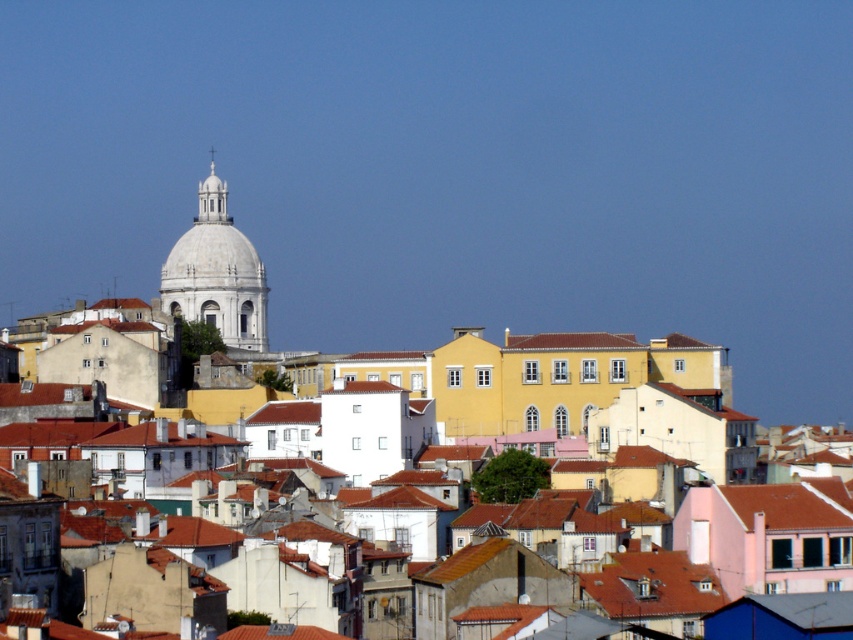
You are an architect analyzing the urban layout of this historic city. You notice the yellow matte building at center and the white marble dome at upper center. Based on their positions and sizes, which structure would cast a longer shadow during midday? Please explain your reasoning.

The white marble dome at upper center is taller than the yellow matte building at center. Since taller structures cast longer shadows, the white marble dome at upper center would cast a longer shadow during midday.

You are standing in the city square and want to take a photo of the point at coordinates point [135,483]. If your camera can focus up to 500 feet, will it be able to capture the point clearly?

The distance of point [135,483] from the viewer is 467.71 feet, which is within the camera focus range of 500 feet. Therefore, the camera can capture the point clearly.

You are an architect analyzing the urban layout. Given that the yellow matte building at center and the white marble dome at upper center are both key structures in the city, which one occupies a more prominent spatial presence in the scene?

The white marble dome at upper center occupies a more prominent spatial presence because it is larger than the yellow matte building at center.